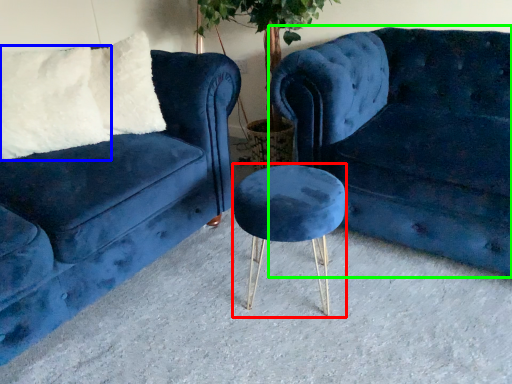
Question: Which object is positioned farthest from bar stool (highlighted by a red box)? Select from pillow (highlighted by a blue box) and studio couch (highlighted by a green box).

Choices:
 (A) pillow
 (B) studio couch

Answer: (A)